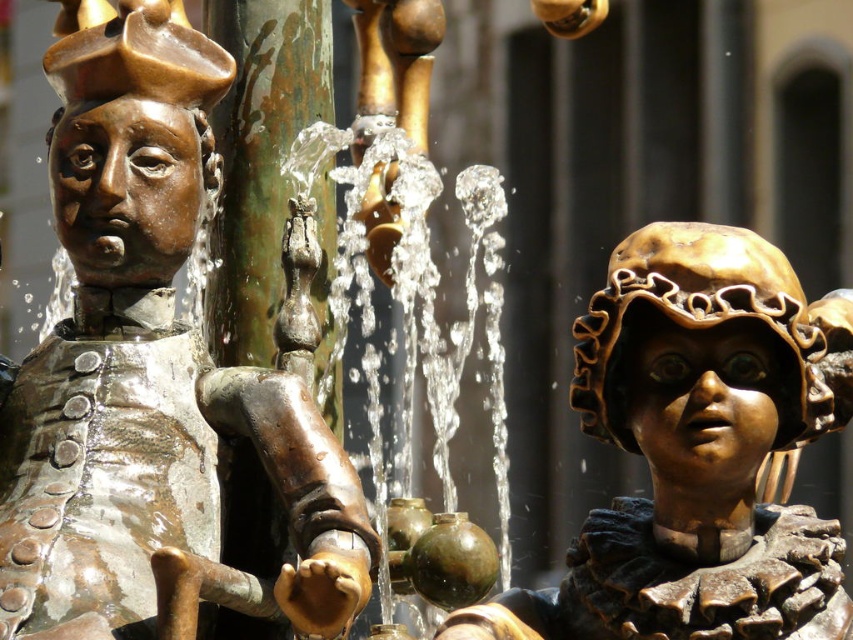
Who is more distant from viewer, (33, 580) or (659, 573)?

Point (659, 573)

Image resolution: width=853 pixels, height=640 pixels. What do you see at coordinates (148, 362) in the screenshot?
I see `bronze statue at center` at bounding box center [148, 362].

Does point (128, 176) come farther from viewer compared to point (724, 252)?

That is True.

I want to click on bronze statue at center, so [x=148, y=362].